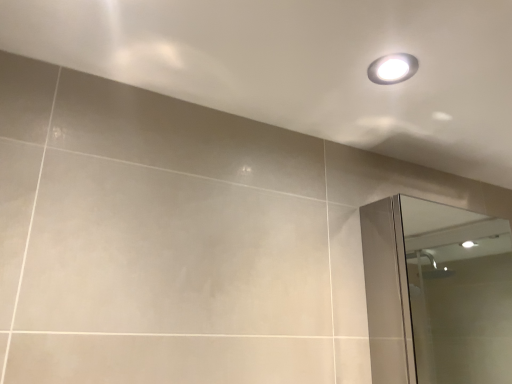
Describe the element at coordinates (458, 293) in the screenshot. I see `clear glass mirror at right` at that location.

Locate an element on the screen. This screenshot has height=384, width=512. clear glass mirror at right is located at coordinates point(458,293).

The height and width of the screenshot is (384, 512). Find the location of `clear glass mirror at right`. clear glass mirror at right is located at coordinates (458, 293).